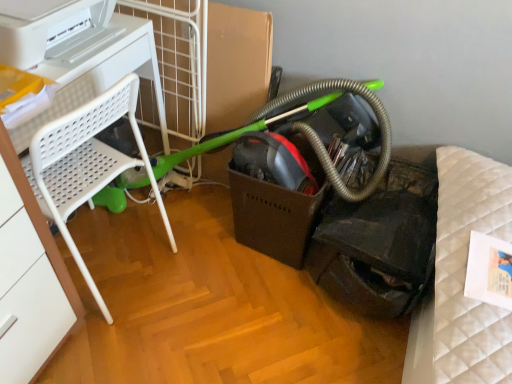
Question: Does green rubber garden hose at center touch white plastic chair at left?

Choices:
 (A) yes
 (B) no

Answer: (B)

Question: Is green rubber garden hose at center further to the viewer compared to white plastic chair at left?

Choices:
 (A) no
 (B) yes

Answer: (B)

Question: Is green rubber garden hose at center to the left of white plastic chair at left from the viewer's perspective?

Choices:
 (A) no
 (B) yes

Answer: (A)

Question: Does green rubber garden hose at center have a smaller size compared to white plastic chair at left?

Choices:
 (A) no
 (B) yes

Answer: (B)

Question: Is white plastic chair at left located within green rubber garden hose at center?

Choices:
 (A) no
 (B) yes

Answer: (A)

Question: Can you confirm if green rubber garden hose at center is positioned to the right of white plastic chair at left?

Choices:
 (A) no
 (B) yes

Answer: (B)

Question: From the image's perspective, is white plastic chair at left below white plastic printer at upper left?

Choices:
 (A) yes
 (B) no

Answer: (A)

Question: Is white plastic chair at left in contact with white plastic printer at upper left?

Choices:
 (A) yes
 (B) no

Answer: (A)

Question: Is white plastic chair at left in front of white plastic printer at upper left?

Choices:
 (A) yes
 (B) no

Answer: (B)

Question: Is white plastic chair at left smaller than white plastic printer at upper left?

Choices:
 (A) no
 (B) yes

Answer: (A)

Question: From a real-world perspective, is white plastic chair at left physically below white plastic printer at upper left?

Choices:
 (A) yes
 (B) no

Answer: (A)

Question: Is white plastic printer at upper left surrounded by white plastic chair at left?

Choices:
 (A) yes
 (B) no

Answer: (B)

Question: Is green rubber garden hose at center located within white plastic printer at upper left?

Choices:
 (A) no
 (B) yes

Answer: (A)